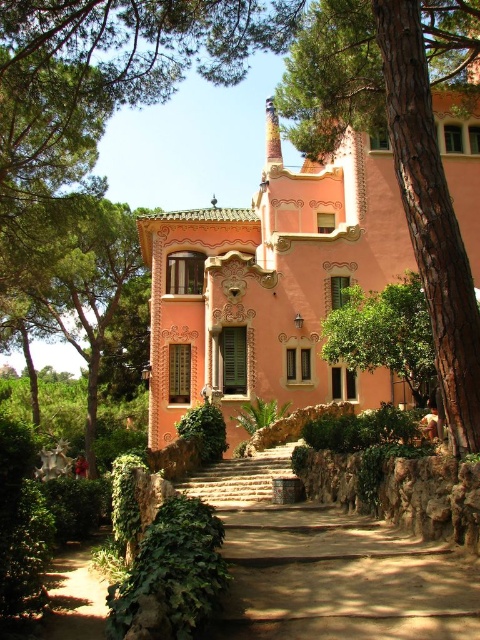
You are standing in front of the building and want to determine which tree is taller between the green leafy tree at left and the green leafy tree at center. Based on the scene, which one is taller?

The green leafy tree at left is much taller than the green leafy tree at center.

You are standing in front of the building and notice two green leafy trees. One is labeled as the green leafy tree at left and the other as the green leafy tree at center. Which tree is positioned lower in the image?

The green leafy tree at left is located below the green leafy tree at center, so it is positioned lower in the image.

You are standing in front of the building and notice two points marked on the facade. The first point is at coordinates point (446, 19) and the second at point (328, 364). Which point is closer to you?

Point (446, 19) is in front of point (328, 364), so it is closer to you.